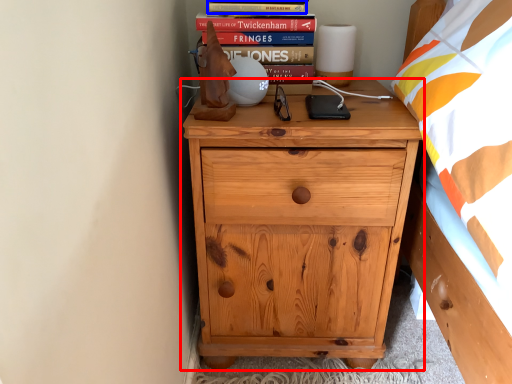
Question: Which point is further to the camera, chest of drawers (highlighted by a red box) or paperback book (highlighted by a blue box)?

Choices:
 (A) chest of drawers
 (B) paperback book

Answer: (B)